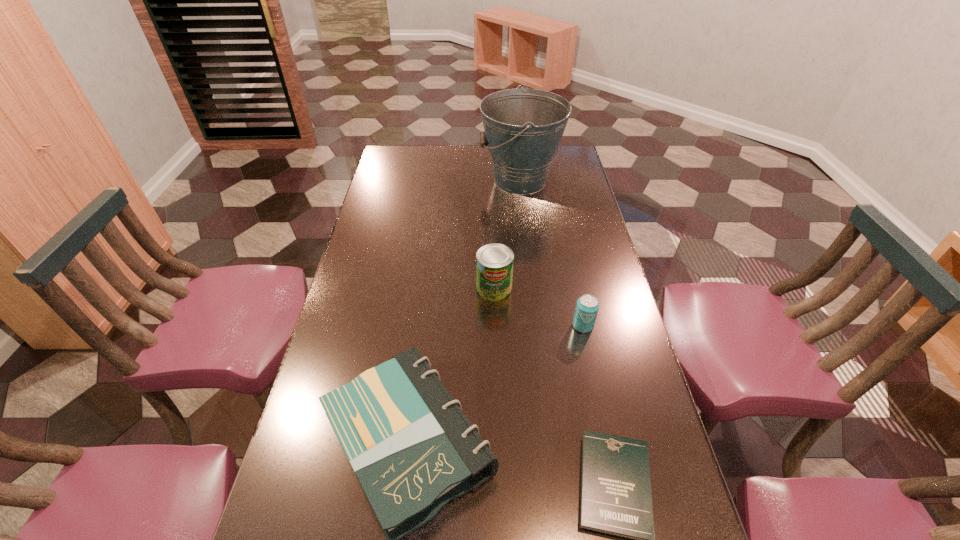
The width and height of the screenshot is (960, 540). I want to click on free spot between the second farthest object and the farthest object, so click(x=507, y=234).

This screenshot has height=540, width=960. Identify the location of the third closest object relative to the paperback book. (587, 306).

At what (x,y) coordinates should I click in order to perform the action: click on object identified as the closest to the third farthest object. Please return your answer as a coordinate pair (x, y). Looking at the image, I should click on (494, 262).

Locate an element on the screen. free space that satisfies the following two spatial constraints: 1. with the handle on opposite sides of the tallest object; 2. on the front side of the second tallest object is located at coordinates (533, 288).

Find the location of a particular element. The width and height of the screenshot is (960, 540). free space in the image that satisfies the following two spatial constraints: 1. with the handle on opposite sides of the third nearest object; 2. on the left side of the farthest object is located at coordinates (538, 326).